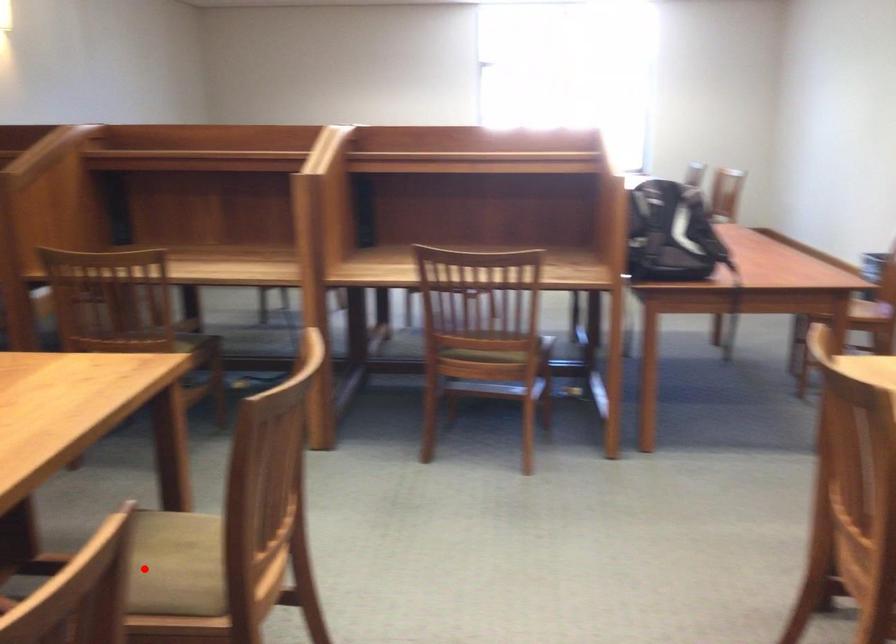
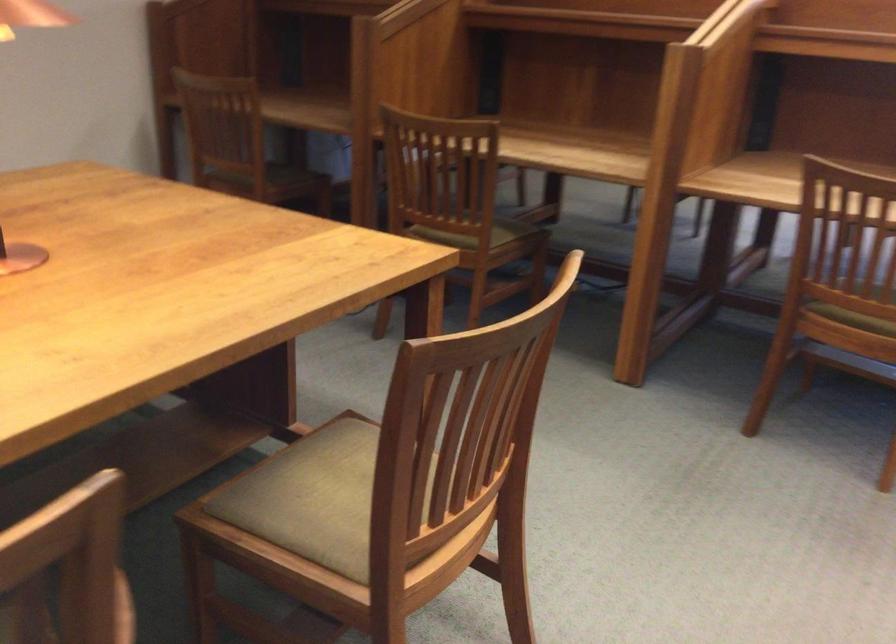
Where in the second image is the point corresponding to the highlighted location from the first image?

(314, 498)